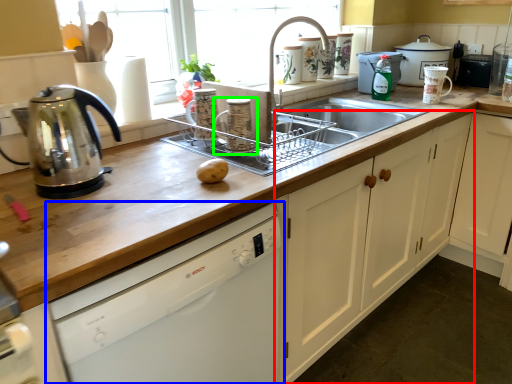
Question: Which object is positioned closest to cabinetry (highlighted by a red box)? Select from dishwasher (highlighted by a blue box) and appliance (highlighted by a green box).

Choices:
 (A) dishwasher
 (B) appliance

Answer: (A)